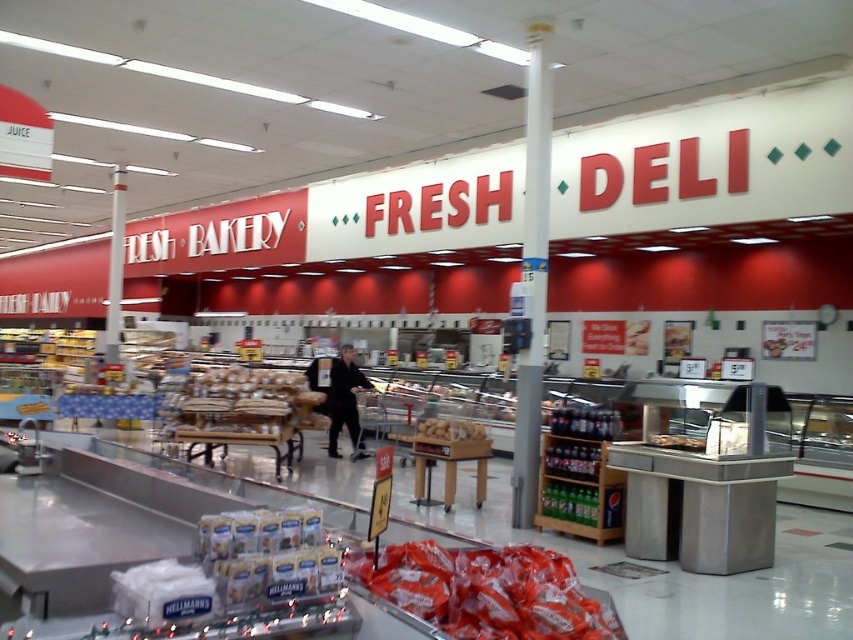
You are a grocery store employee who needs to place a new shelf that is 5 meters long between the matte plastic bags of chips at center and the smooth brown bread at center. Can you fit the shelf between them without moving either item?

The distance between the matte plastic bags of chips at center and the smooth brown bread at center is 5.37 meters. Since the shelf is 5 meters long, it can be placed between them as the available space is slightly larger than the shelf length.

You are a customer looking at the display case in the grocery store. You notice two types of bread labeled as bread matte at center and smooth brown bread at center. Which bread is taller?

The bread matte at center is much taller than the smooth brown bread at center.

You are standing in the grocery store and want to take a photo of the point at coordinates (x=469, y=605). If your camera has a focal length of 50mm and the sensor size is 24mm wide, what is the minimum distance you need to be from the point to ensure the entire scene fits in the frame?

The point at coordinates (x=469, y=605) is 2.10 meters away from the camera. To ensure the entire scene fits in the frame, you need to be at least 2.10 meters away from the point.